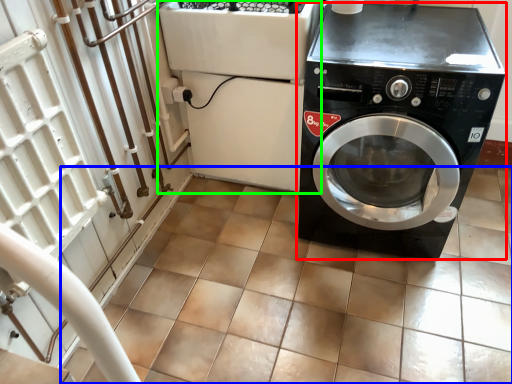
Question: Which is nearer to the washing machine (highlighted by a red box)? tile (highlighted by a blue box) or appliance (highlighted by a green box).

Choices:
 (A) tile
 (B) appliance

Answer: (B)